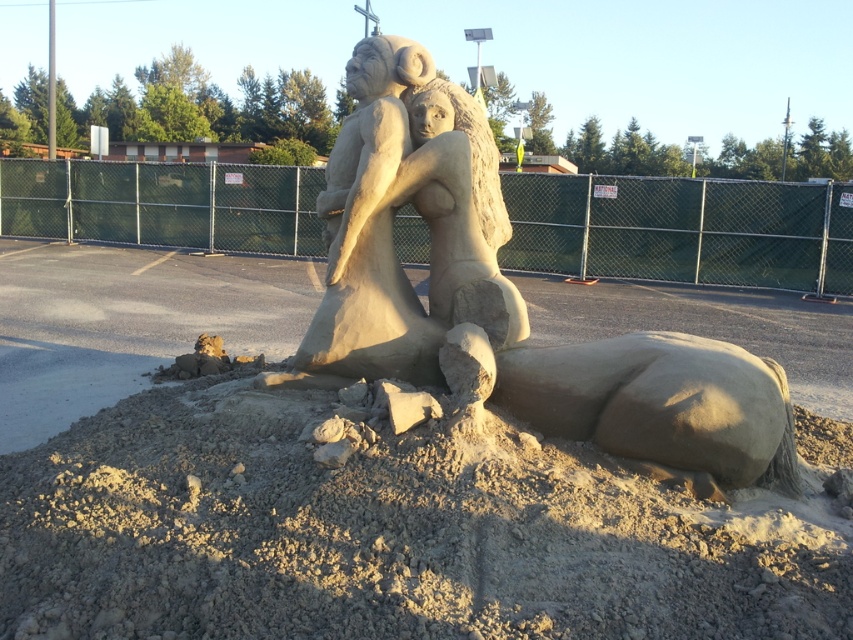
Can you confirm if dry sand at center is positioned to the left of sand sculpture at center?

Correct, you'll find dry sand at center to the left of sand sculpture at center.

Is dry sand at center wider than sand sculpture at center?

Yes, dry sand at center is wider than sand sculpture at center.

Does point (561, 465) come behind point (473, 257)?

No, it is in front of (473, 257).

The image size is (853, 640). I want to click on dry sand at center, so click(379, 536).

Does dry sand at center have a greater height compared to smooth sand sculpture at center?

No.

Which is more to the left, dry sand at center or smooth sand sculpture at center?

dry sand at center

What do you see at coordinates (379, 536) in the screenshot? Image resolution: width=853 pixels, height=640 pixels. I see `dry sand at center` at bounding box center [379, 536].

This screenshot has width=853, height=640. Identify the location of dry sand at center. (379, 536).

Between point (485, 307) and point (444, 193), which one is positioned in front?

Point (485, 307) is more forward.

Is point (608, 422) more distant than point (498, 195)?

No, (608, 422) is closer to viewer.

Between point (378, 138) and point (503, 298), which one is positioned behind?

Positioned behind is point (378, 138).

Image resolution: width=853 pixels, height=640 pixels. What are the coordinates of `sand sculpture at center` in the screenshot? It's located at (508, 298).